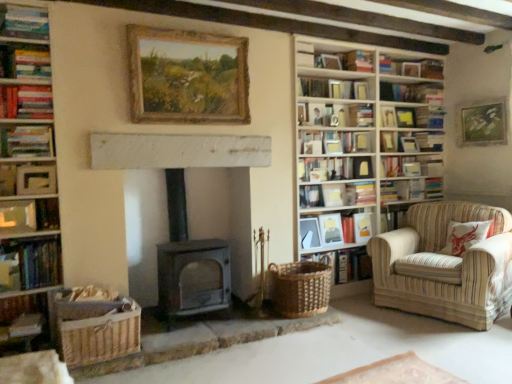
Locate an element on the screen. blank area beneath hardcover book at left, arranged as the sixth book when viewed from the top (from a real-world perspective) is located at coordinates (28, 235).